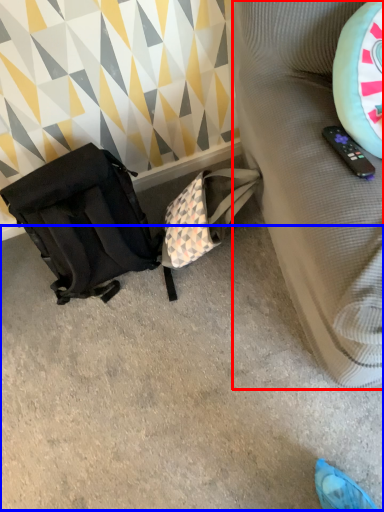
Question: Which object is further to the camera taking this photo, furniture (highlighted by a red box) or concrete (highlighted by a blue box)?

Choices:
 (A) furniture
 (B) concrete

Answer: (B)